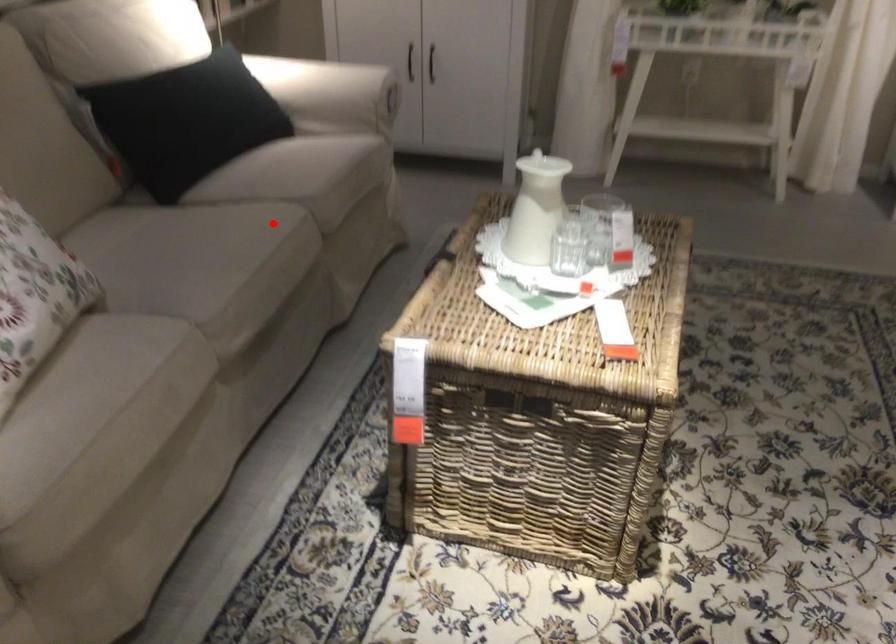
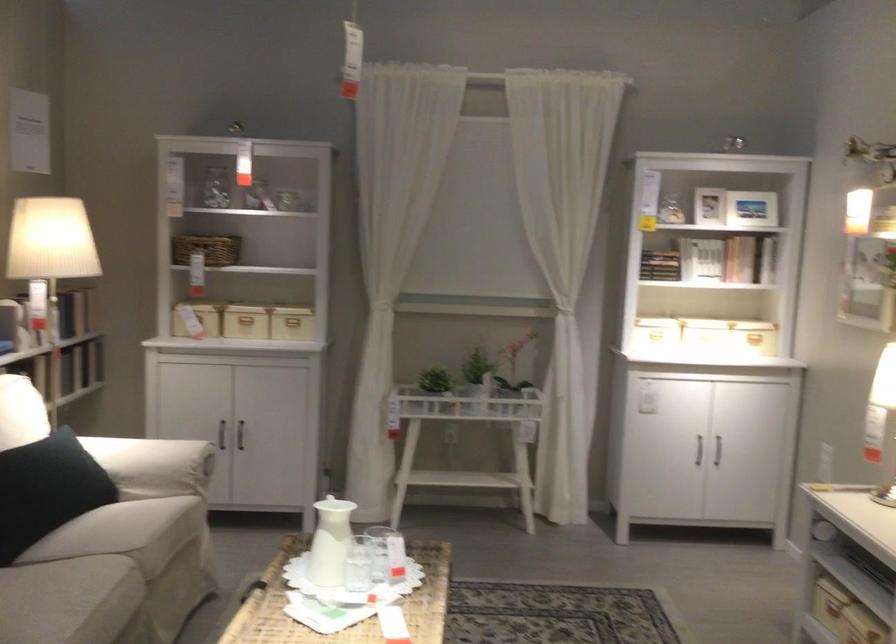
Question: I am providing you with two images of the same scene from different viewpoints. Given a red point in image1, look at the same physical point in image2. Is it:

Choices:
 (A) Closer to the viewpoint
 (B) Farther from the viewpoint

Answer: (B)